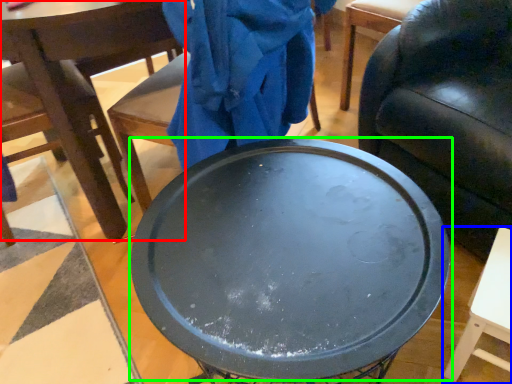
Question: Considering the real-world distances, which object is closest to chair (highlighted by a red box)? table (highlighted by a blue box) or round table (highlighted by a green box).

Choices:
 (A) table
 (B) round table

Answer: (B)